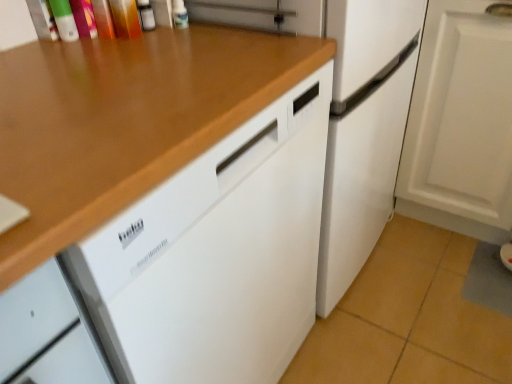
This screenshot has width=512, height=384. Find the location of `vacant region above wooden at upper left (from a real-world perspective)`. vacant region above wooden at upper left (from a real-world perspective) is located at coordinates (133, 71).